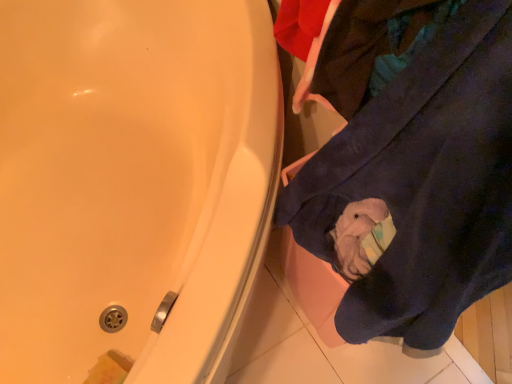
Question: Do you think matte white bathtub at upper left is within navy blue towel at lower right, or outside of it?

Choices:
 (A) outside
 (B) inside

Answer: (A)

Question: Considering the positions of point (82, 120) and point (331, 231), is point (82, 120) closer or farther from the camera than point (331, 231)?

Choices:
 (A) farther
 (B) closer

Answer: (A)

Question: In the image, is matte white bathtub at upper left on the left side or the right side of navy blue towel at lower right?

Choices:
 (A) right
 (B) left

Answer: (B)

Question: Considering the positions of point (293, 99) and point (74, 284), is point (293, 99) closer or farther from the camera than point (74, 284)?

Choices:
 (A) farther
 (B) closer

Answer: (A)

Question: Is navy blue towel at lower right to the left or to the right of matte white bathtub at upper left in the image?

Choices:
 (A) left
 (B) right

Answer: (B)

Question: Is navy blue towel at lower right situated inside matte white bathtub at upper left or outside?

Choices:
 (A) inside
 (B) outside

Answer: (A)

Question: Looking at the image, does navy blue towel at lower right seem bigger or smaller compared to matte white bathtub at upper left?

Choices:
 (A) small
 (B) big

Answer: (A)